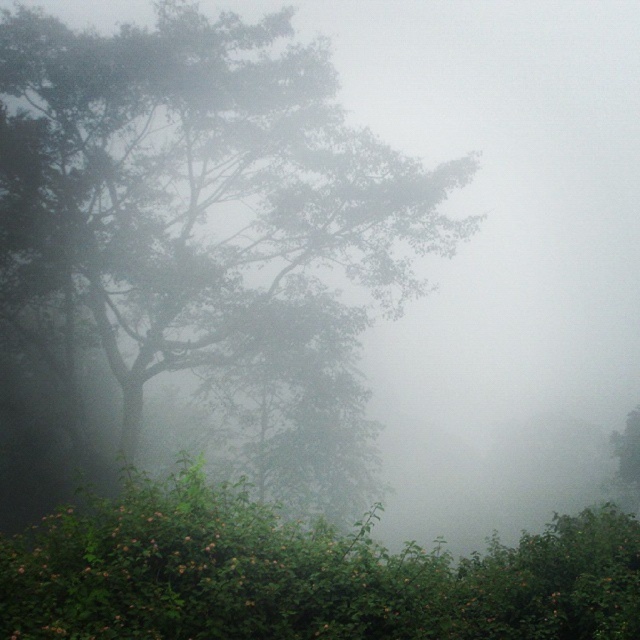
Question: Does green leafy tree at left have a lesser width compared to green leafy bush at lower center?

Choices:
 (A) no
 (B) yes

Answer: (A)

Question: Among these objects, which one is farthest from the camera?

Choices:
 (A) green leafy bush at lower center
 (B) green leafy tree at left

Answer: (B)

Question: Which of the following is the farthest from the observer?

Choices:
 (A) (280, 269)
 (B) (371, 561)

Answer: (A)

Question: Does green leafy tree at left lie behind green leafy bush at lower center?

Choices:
 (A) yes
 (B) no

Answer: (A)

Question: Among these objects, which one is nearest to the camera?

Choices:
 (A) green leafy tree at left
 (B) green leafy bush at lower center

Answer: (B)

Question: Is green leafy tree at left to the left of green leafy bush at lower center from the viewer's perspective?

Choices:
 (A) no
 (B) yes

Answer: (A)